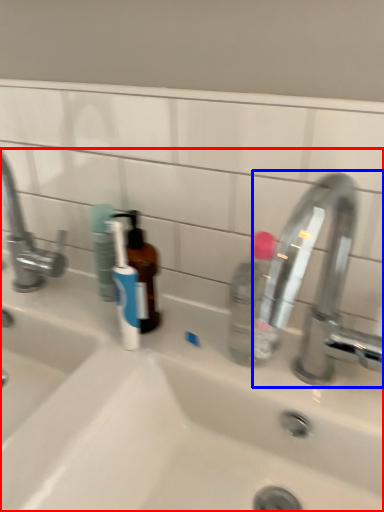
Question: Which object appears farthest to the camera in this image, sink (highlighted by a red box) or tap (highlighted by a blue box)?

Choices:
 (A) sink
 (B) tap

Answer: (B)